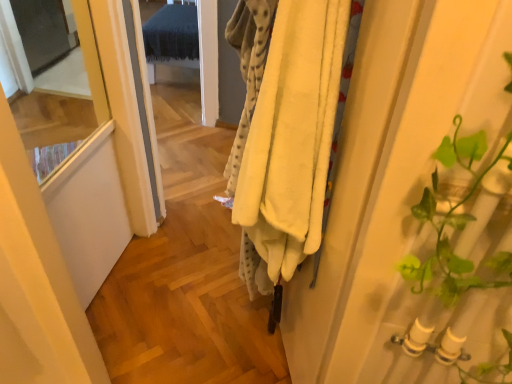
Question: Can you confirm if soft yellow fleece blanket at center is thinner than transparent glass screen door at upper left?

Choices:
 (A) no
 (B) yes

Answer: (B)

Question: From the image's perspective, is soft yellow fleece blanket at center below transparent glass screen door at upper left?

Choices:
 (A) yes
 (B) no

Answer: (A)

Question: Can you confirm if soft yellow fleece blanket at center is taller than transparent glass screen door at upper left?

Choices:
 (A) yes
 (B) no

Answer: (A)

Question: Is soft yellow fleece blanket at center positioned beyond the bounds of transparent glass screen door at upper left?

Choices:
 (A) yes
 (B) no

Answer: (A)

Question: Is transparent glass screen door at upper left a part of soft yellow fleece blanket at center?

Choices:
 (A) no
 (B) yes

Answer: (A)

Question: Does soft yellow fleece blanket at center have a greater width compared to transparent glass screen door at upper left?

Choices:
 (A) yes
 (B) no

Answer: (B)

Question: Is transparent glass screen door at upper left behind soft yellow fleece blanket at center?

Choices:
 (A) no
 (B) yes

Answer: (B)

Question: Can you confirm if transparent glass screen door at upper left is bigger than soft yellow fleece blanket at center?

Choices:
 (A) no
 (B) yes

Answer: (B)

Question: Considering the relative sizes of transparent glass screen door at upper left and soft yellow fleece blanket at center in the image provided, is transparent glass screen door at upper left shorter than soft yellow fleece blanket at center?

Choices:
 (A) yes
 (B) no

Answer: (A)

Question: Does transparent glass screen door at upper left have a lesser width compared to soft yellow fleece blanket at center?

Choices:
 (A) yes
 (B) no

Answer: (B)

Question: Is transparent glass screen door at upper left to the left of soft yellow fleece blanket at center from the viewer's perspective?

Choices:
 (A) no
 (B) yes

Answer: (B)

Question: Does transparent glass screen door at upper left have a greater height compared to soft yellow fleece blanket at center?

Choices:
 (A) yes
 (B) no

Answer: (B)

Question: Based on their positions, is transparent glass screen door at upper left located to the left or right of soft yellow fleece blanket at center?

Choices:
 (A) left
 (B) right

Answer: (A)